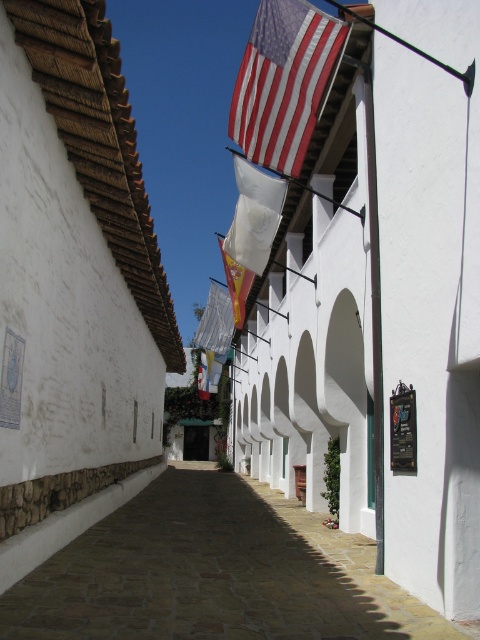
Does brown stone alley at center have a larger size compared to yellow fabric flag at center?

Yes, brown stone alley at center is bigger than yellow fabric flag at center.

Can you confirm if brown stone alley at center is positioned below yellow fabric flag at center?

Correct, brown stone alley at center is located below yellow fabric flag at center.

Identify the location of brown stone alley at center. Image resolution: width=480 pixels, height=640 pixels. (216, 572).

Who is more forward, (x=250, y=532) or (x=287, y=28)?

Point (x=287, y=28) is in front.

Does point (156, 490) lie behind point (297, 68)?

Yes, point (156, 490) is behind point (297, 68).

Measure the distance between brown stone alley at center and camera.

A distance of 5.48 meters exists between brown stone alley at center and camera.

Locate an element on the screen. The width and height of the screenshot is (480, 640). brown stone alley at center is located at coordinates (216, 572).

Measure the distance from red-white striped fabric flag at upper center to yellow fabric flag at center.

red-white striped fabric flag at upper center is 6.01 meters from yellow fabric flag at center.

Does red-white striped fabric flag at upper center appear on the right side of yellow fabric flag at center?

Correct, you'll find red-white striped fabric flag at upper center to the right of yellow fabric flag at center.

At what (x,y) coordinates should I click in order to perform the action: click on red-white striped fabric flag at upper center. Please return your answer as a coordinate pair (x, y). Image resolution: width=480 pixels, height=640 pixels. Looking at the image, I should click on (285, 81).